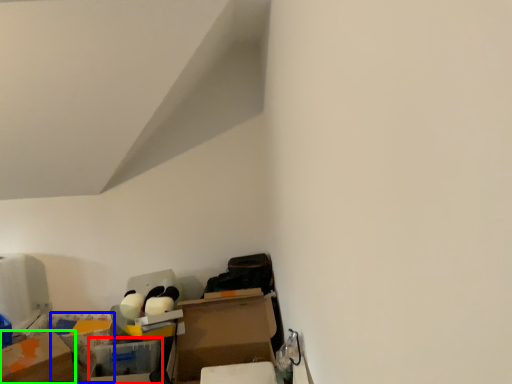
Question: Estimate the real-world distances between objects in this image. Which object is closer to storage box (highlighted by a red box), storage box (highlighted by a blue box) or cardboard box (highlighted by a green box)?

Choices:
 (A) storage box
 (B) cardboard box

Answer: (B)